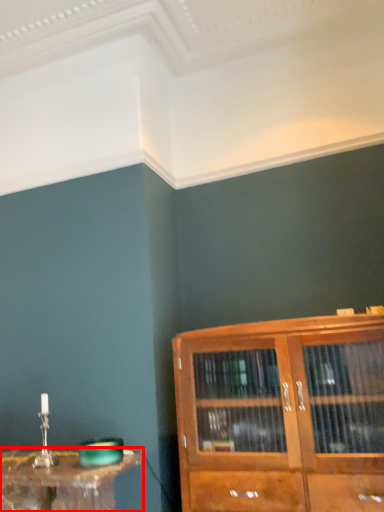
Question: Considering the relative positions of table (annotated by the red box) and cupboard in the image provided, where is table (annotated by the red box) located with respect to the staircase?

Choices:
 (A) left
 (B) right

Answer: (A)